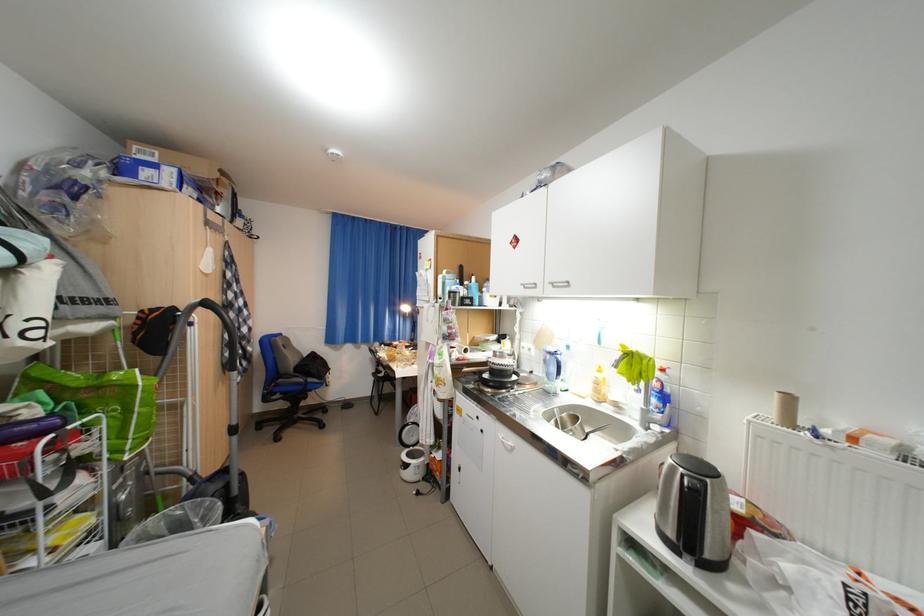
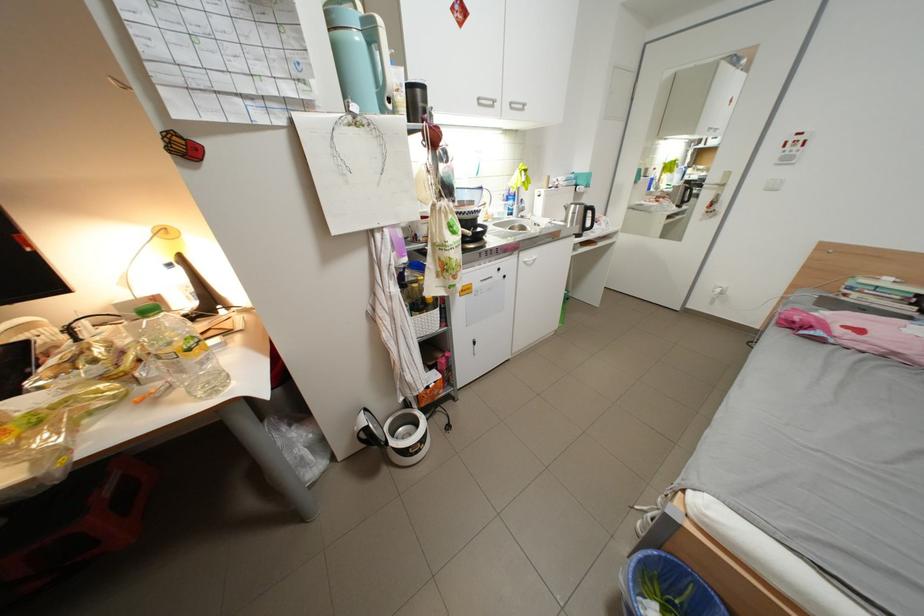
Locate, in the second image, the point that corresponds to pixel 564 285 in the first image.

(523, 105)